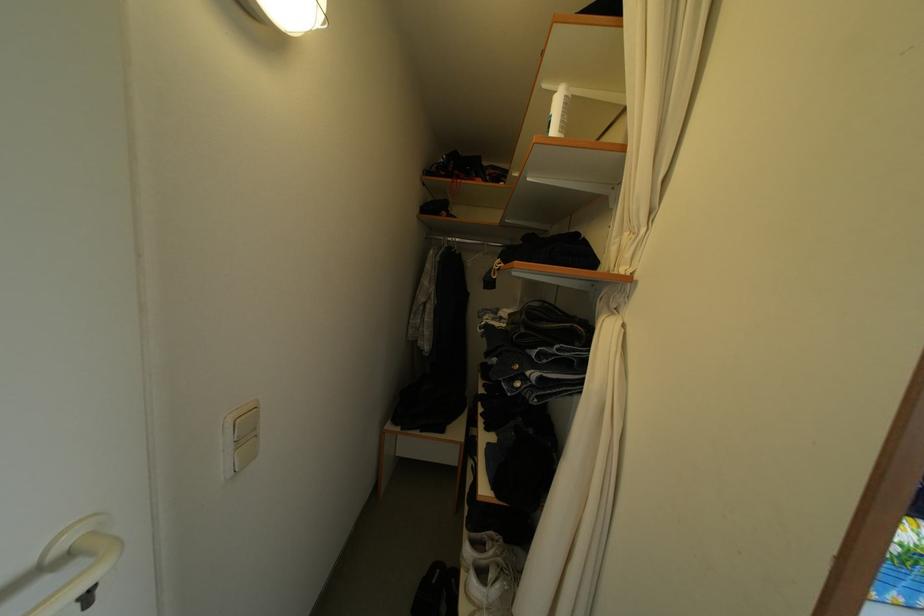
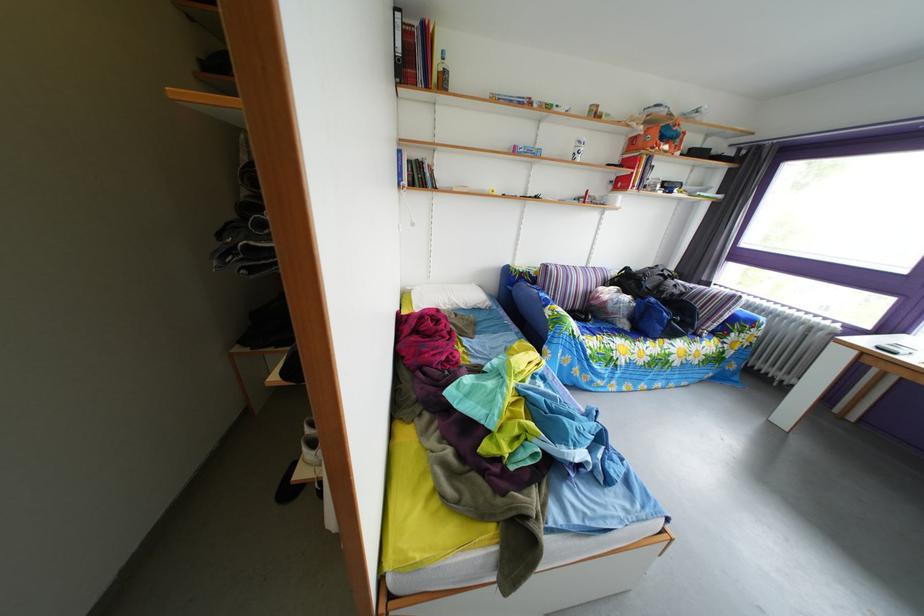
Question: The first image is from the beginning of the video and the second image is from the end. How did the camera likely rotate when shooting the video?

Choices:
 (A) Left
 (B) Right
 (C) Up
 (D) Down

Answer: (D)